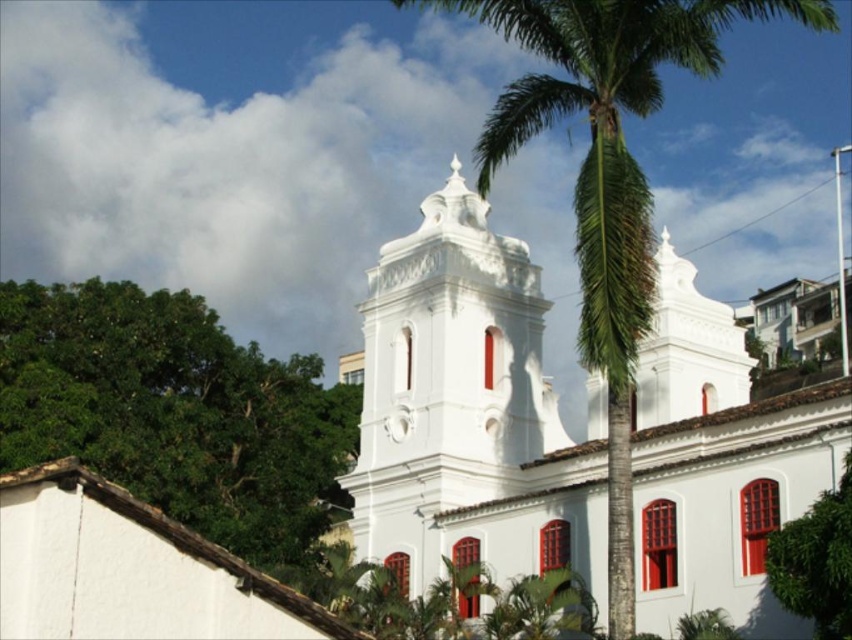
Question: Which point appears closest to the camera in this image?

Choices:
 (A) (781, 584)
 (B) (484, 364)
 (C) (95, 424)
 (D) (622, 346)

Answer: (A)

Question: Does white stucco bell tower at center have a lesser width compared to green leafy tree at center?

Choices:
 (A) yes
 (B) no

Answer: (B)

Question: Estimate the real-world distances between objects in this image. Which object is closer to the green leafy tree at center?

Choices:
 (A) green leafy palm tree at center
 (B) white stucco bell tower at center

Answer: (B)

Question: Is green leafy tree at left below green leafy tree at center?

Choices:
 (A) no
 (B) yes

Answer: (A)

Question: Which object is the closest to the white stucco bell tower at center?

Choices:
 (A) green leafy tree at left
 (B) green leafy tree at center
 (C) green leafy palm tree at center

Answer: (A)

Question: Is green leafy tree at left further to the viewer compared to white stucco bell tower at center?

Choices:
 (A) no
 (B) yes

Answer: (B)